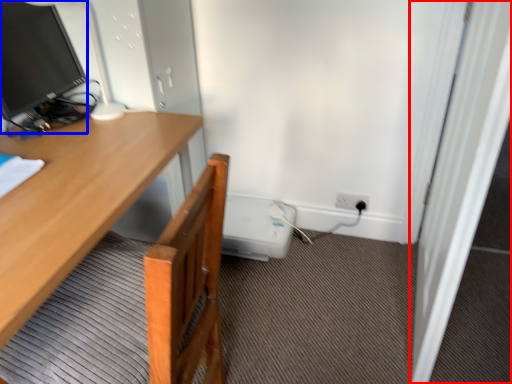
Question: Which point is further to the camera, screen door (highlighted by a red box) or television (highlighted by a blue box)?

Choices:
 (A) screen door
 (B) television

Answer: (B)